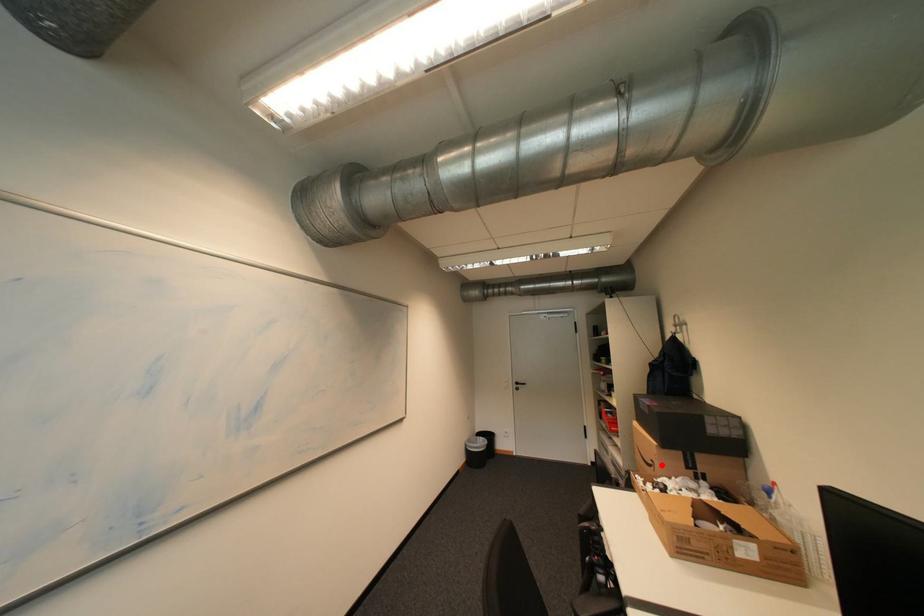
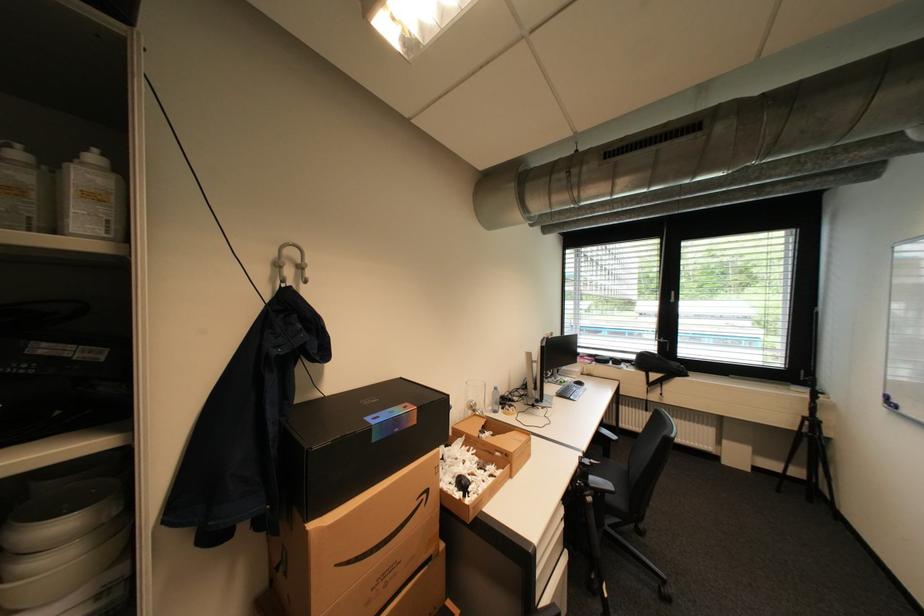
Question: I am providing you with two images of the same scene from different viewpoints. Image1 has a red point marked. In image2, the corresponding 3D location appears at what relative position? Reply with the corresponding letter.

Choices:
 (A) Closer
 (B) Farther

Answer: (B)